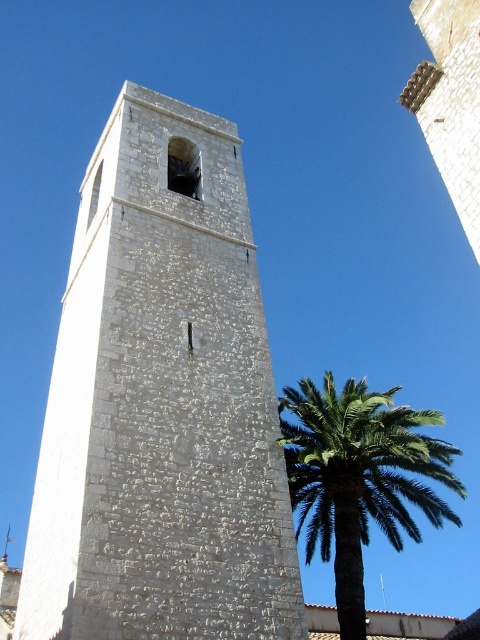
You are an architect designing a new garden layout. You need to place a statue exactly between the white stone bell tower at center and the green leafy palm at right. Which object will the statue be closer to, and why?

The statue will be closer to the green leafy palm at right because the white stone bell tower at center is thinner than the green leafy palm at right, so the palm is wider and occupies more space, making the midpoint closer to it.

You are standing in front of the white stone bell tower at center and the green leafy palm at right. Which object is taller?

The green leafy palm at right is taller than the white stone bell tower at center.